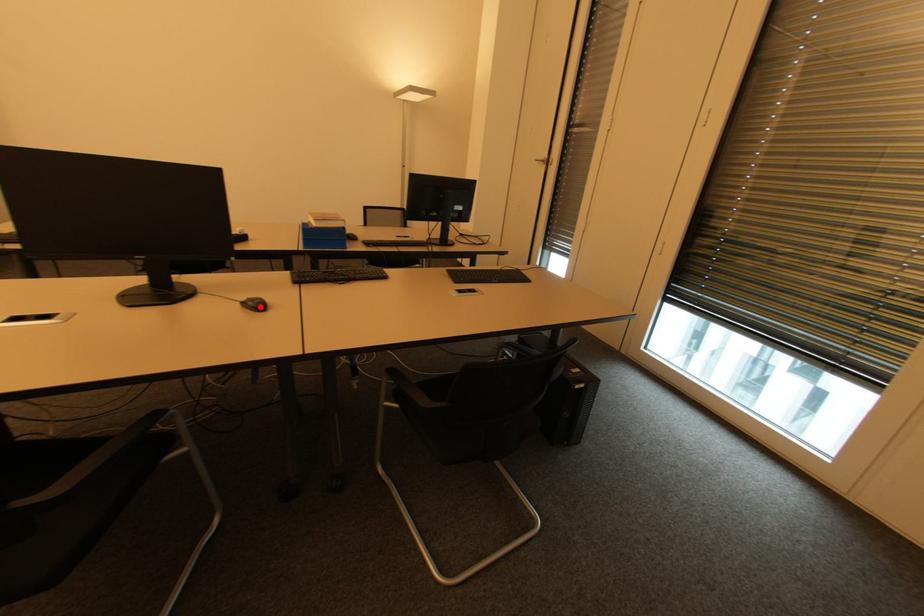
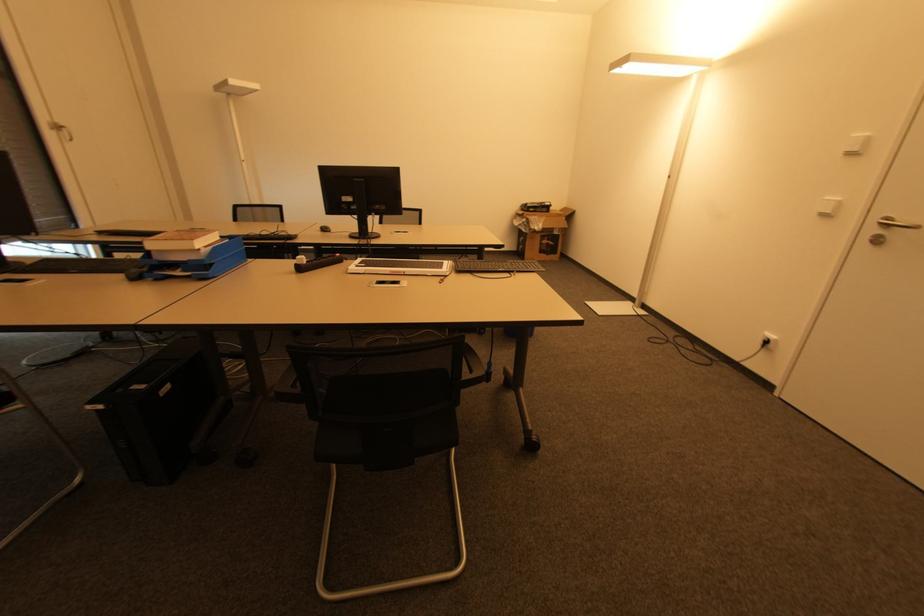
The point at the highlighted location is marked in the first image. Where is the corresponding point in the second image?

(325, 230)